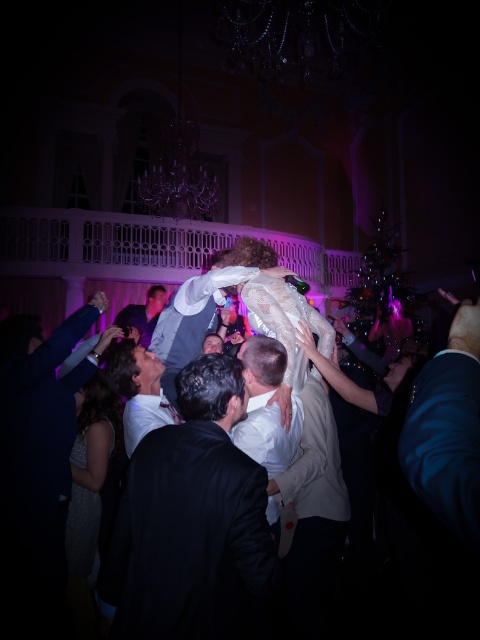
You are standing at the entrance of the hall and want to locate the dark suit at center. Which direction should you look to find it?

You should look towards the center of the hall to find the dark suit at center, as it is located at point (191, 518) which corresponds to the central area.

You are standing at the entrance of the hall and want to locate the dark suit at center. According to the coordinates provided, where should you look to find it?

The dark suit at center is located at the 2D coordinates point (191, 518), which means it is positioned towards the right side and slightly below the center of the image.